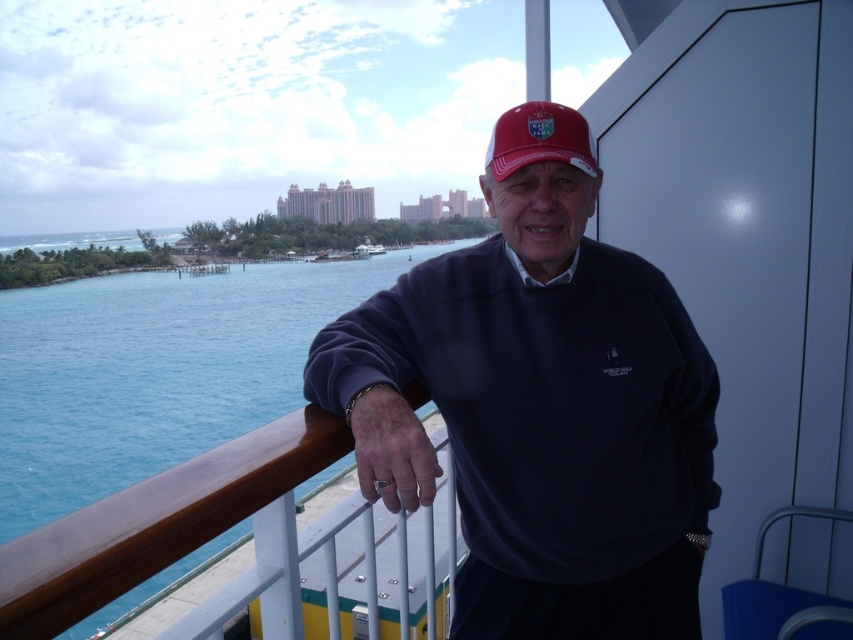
You are a photographer trying to capture the man in the navy blue sweater at center. To ensure the sweater is in focus, you need to know its exact position. What are the coordinates of the matte navy blue sweater at center?

The coordinates of the matte navy blue sweater at center are at point (540, 419).

Looking at this image, you are a fashion designer observing the scene. You need to determine which object occupies more visual space in the image between the matte navy blue sweater at center and the blue water at left. Which one is larger?

The blue water at left is larger than the matte navy blue sweater at center, so the blue water at left occupies more visual space.